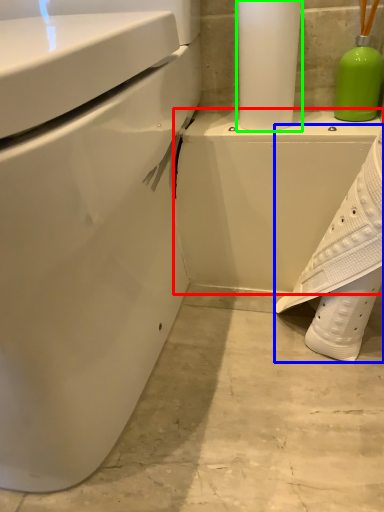
Question: Estimate the real-world distances between objects in this image. Which object is farther from porcelain (highlighted by a red box), shoe (highlighted by a blue box) or paper towel (highlighted by a green box)?

Choices:
 (A) shoe
 (B) paper towel

Answer: (B)